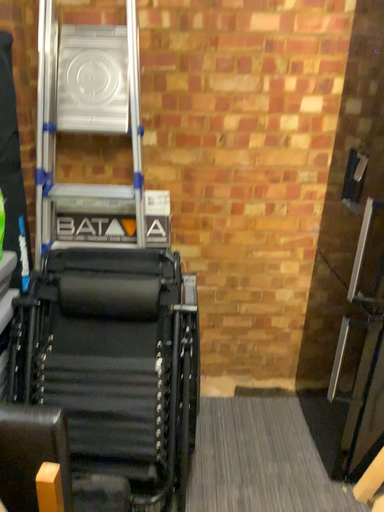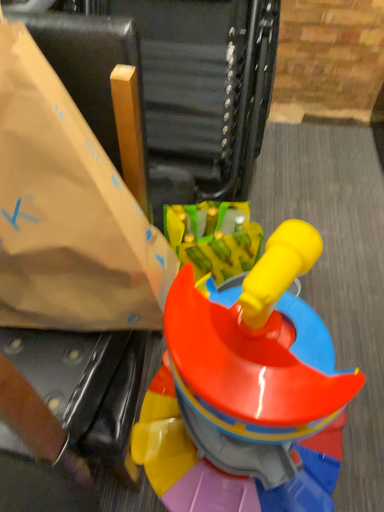
Question: How did the camera likely rotate when shooting the video?

Choices:
 (A) rotated upward
 (B) rotated downward

Answer: (B)